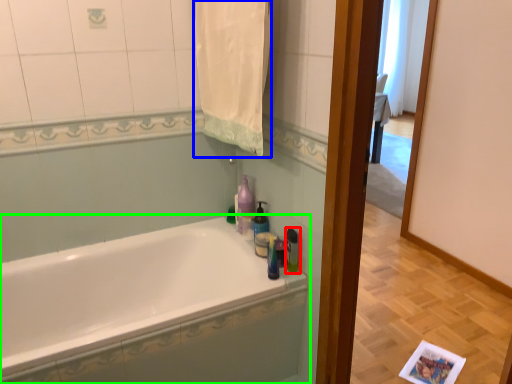
Question: Which object is positioned farthest from toiletry (highlighted by a red box)? Select from bath towel (highlighted by a blue box) and bathtub (highlighted by a green box).

Choices:
 (A) bath towel
 (B) bathtub

Answer: (A)